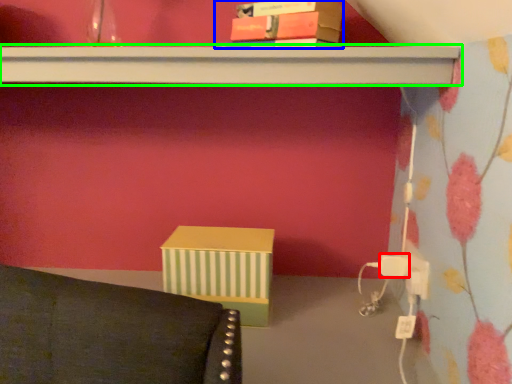
Question: Which object is the closest to the plug (highlighted by a red box)? Choose among these: book (highlighted by a blue box) or shelf (highlighted by a green box).

Choices:
 (A) book
 (B) shelf

Answer: (B)